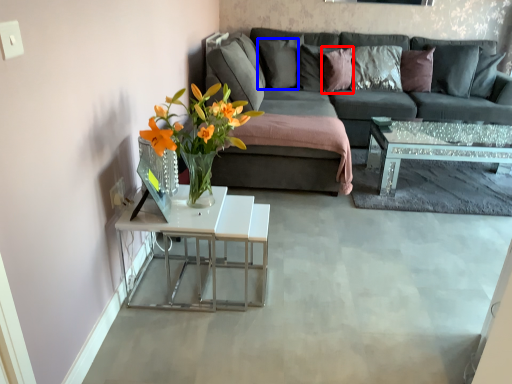
Question: Which object appears closest to the camera in this image, pillow (highlighted by a red box) or pillow (highlighted by a blue box)?

Choices:
 (A) pillow
 (B) pillow

Answer: (A)